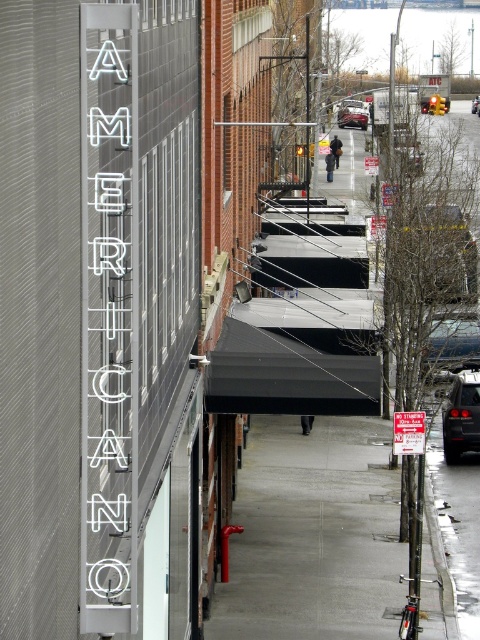
Question: Which point is closer to the camera?

Choices:
 (A) gray concrete sidewalk at center
 (B) shiny black car at center right
 (C) metallic silver car at center
 (D) red plastic sign at center

Answer: (D)

Question: Which point appears closest to the camera in this image?

Choices:
 (A) (474, 102)
 (B) (368, 116)

Answer: (B)

Question: Can you confirm if red plastic sign at center is smaller than metallic silver car at center?

Choices:
 (A) yes
 (B) no

Answer: (A)

Question: Which object appears closest to the camera in this image?

Choices:
 (A) red plastic sign at center
 (B) shiny black sedan at center
 (C) shiny black car at center right
 (D) metallic silver car at center

Answer: (A)

Question: Considering the relative positions of metallic silver car at center and shiny black sedan at center in the image provided, where is metallic silver car at center located with respect to shiny black sedan at center?

Choices:
 (A) right
 (B) left

Answer: (B)

Question: Is shiny black car at center right positioned behind metallic silver car at center?

Choices:
 (A) no
 (B) yes

Answer: (A)